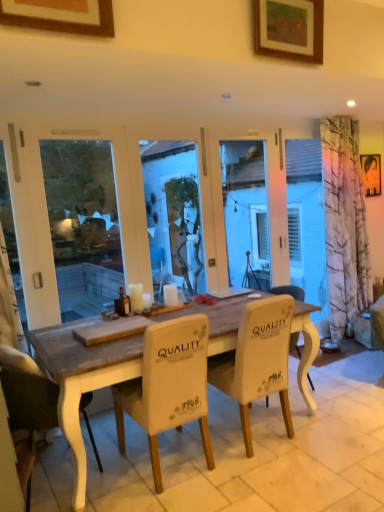
What do you see at coordinates (371, 174) in the screenshot?
I see `metallic silver portrait at upper right, the 3th picture frame viewed from the left` at bounding box center [371, 174].

Image resolution: width=384 pixels, height=512 pixels. What do you see at coordinates (170, 295) in the screenshot?
I see `white matte candle at center, which is the second candle in left-to-right order` at bounding box center [170, 295].

Locate an element on the screen. Image resolution: width=384 pixels, height=512 pixels. white fabric chair at center, the 2th chair when ordered from right to left is located at coordinates (168, 386).

The image size is (384, 512). What are the coordinates of `wooden picture frame at upper center, which is counted as the third picture frame, starting from the right` in the screenshot? It's located at (60, 15).

The image size is (384, 512). Describe the element at coordinates (136, 297) in the screenshot. I see `white wax candle at center, the second candle viewed from the right` at that location.

Where is `matte glass bottle at center`? This screenshot has height=512, width=384. matte glass bottle at center is located at coordinates (124, 300).

Measure the distance between matte glass bottle at center and camera.

They are 9.90 feet apart.

Identify the location of metallic silver portrait at upper right, the 3th picture frame viewed from the left. This screenshot has width=384, height=512. (371, 174).

Is white fabric chair at center, the third chair viewed from the left, not near white fabric chair at lower left, which ranks as the first chair in left-to-right order?

Yes.

How different are the orientations of white fabric chair at center, which is the first chair in right-to-left order, and white fabric chair at lower left, which ranks as the first chair in left-to-right order, in degrees?

The facing directions of white fabric chair at center, which is the first chair in right-to-left order, and white fabric chair at lower left, which ranks as the first chair in left-to-right order, are 90 degrees apart.

Is white fabric chair at lower left, the third chair in the right-to-left sequence, surrounded by white fabric chair at center, the third chair viewed from the left?

No, white fabric chair at lower left, the third chair in the right-to-left sequence, is not a part of white fabric chair at center, the third chair viewed from the left.

From the image's perspective, which one is positioned lower, white fabric chair at center, which is the first chair in right-to-left order, or white fabric chair at lower left, which ranks as the first chair in left-to-right order?

white fabric chair at lower left, which ranks as the first chair in left-to-right order, appears lower in the image.

Can you confirm if white fabric chair at center, the 2th chair when ordered from right to left, is thinner than wooden picture frame at upper center, arranged as the 2th picture frame when viewed from the front?

No.

Is white fabric chair at center, the 2th chair when ordered from right to left, taller than wooden picture frame at upper center, arranged as the 2th picture frame when viewed from the front?

Indeed, white fabric chair at center, the 2th chair when ordered from right to left, has a greater height compared to wooden picture frame at upper center, arranged as the 2th picture frame when viewed from the front.

What's the angular difference between white fabric chair at center, the 2th chair when ordered from right to left, and wooden picture frame at upper center, the 2th picture frame viewed from the left,'s facing directions?

white fabric chair at center, the 2th chair when ordered from right to left, and wooden picture frame at upper center, the 2th picture frame viewed from the left, are facing 180 degrees away from each other.

From the image's perspective, is white fabric chair at center, the 2th chair when ordered from right to left, located beneath wooden picture frame at upper center, arranged as the 2th picture frame when viewed from the front?

Correct, white fabric chair at center, the 2th chair when ordered from right to left, appears lower than wooden picture frame at upper center, arranged as the 2th picture frame when viewed from the front, in the image.

Is the position of wooden picture frame at upper center, arranged as the 2th picture frame when viewed from the front, more distant than that of white matte candle at center, which is the second candle in left-to-right order?

No, it is not.

Considering the sizes of objects wooden picture frame at upper center, arranged as the 2th picture frame when viewed from the front, and white matte candle at center, which is the second candle in left-to-right order, in the image provided, who is bigger, wooden picture frame at upper center, arranged as the 2th picture frame when viewed from the front, or white matte candle at center, which is the second candle in left-to-right order,?

With larger size is wooden picture frame at upper center, arranged as the 2th picture frame when viewed from the front.

Who is taller, wooden picture frame at upper center, the 2th picture frame viewed from the left, or white matte candle at center, which is the first candle in right-to-left order?

wooden picture frame at upper center, the 2th picture frame viewed from the left, is taller.

Considering the positions of objects white matte candle at center, which is the first candle in right-to-left order, and wooden picture frame at upper center, the first picture frame viewed from the left, in the image provided, who is in front, white matte candle at center, which is the first candle in right-to-left order, or wooden picture frame at upper center, the first picture frame viewed from the left,?

wooden picture frame at upper center, the first picture frame viewed from the left, is more forward.

From a real-world perspective, does white matte candle at center, which is the second candle in left-to-right order, stand above wooden picture frame at upper center, which ranks as the first picture frame in front-to-back order?

→ No, from a real-world perspective, white matte candle at center, which is the second candle in left-to-right order, is not over wooden picture frame at upper center, which ranks as the first picture frame in front-to-back order

Which object is positioned more to the left, white matte candle at center, which is the second candle in left-to-right order, or wooden picture frame at upper center, which is the 3th picture frame in back-to-front order?

From the viewer's perspective, wooden picture frame at upper center, which is the 3th picture frame in back-to-front order, appears more on the left side.

What's the angular difference between white matte candle at center, which is the second candle in left-to-right order, and wooden picture frame at upper center, which is counted as the third picture frame, starting from the right,'s facing directions?

The angle between the facing direction of white matte candle at center, which is the second candle in left-to-right order, and the facing direction of wooden picture frame at upper center, which is counted as the third picture frame, starting from the right, is 0.00308 degrees.

Where is `chair that is the 1st object located below the wooden picture frame at upper center, which is the 3th picture frame in back-to-front order (from the image's perspective)`? The height and width of the screenshot is (512, 384). chair that is the 1st object located below the wooden picture frame at upper center, which is the 3th picture frame in back-to-front order (from the image's perspective) is located at coordinates (257, 360).

How far apart are white fabric chair at center, which is the first chair in right-to-left order, and wooden picture frame at upper center, which ranks as the first picture frame in front-to-back order?

A distance of 6.13 feet exists between white fabric chair at center, which is the first chair in right-to-left order, and wooden picture frame at upper center, which ranks as the first picture frame in front-to-back order.

Does white fabric chair at center, which is the first chair in right-to-left order, lie in front of wooden picture frame at upper center, the first picture frame viewed from the left?

That is False.

Is white fabric chair at center, the third chair viewed from the left, bigger or smaller than wooden picture frame at upper center, which is the 3th picture frame in back-to-front order?

Considering their sizes, white fabric chair at center, the third chair viewed from the left, takes up more space than wooden picture frame at upper center, which is the 3th picture frame in back-to-front order.

The image size is (384, 512). I want to click on the 1st chair below the matte glass bottle at center (from the image's perspective), so click(x=257, y=360).

How different are the orientations of white fabric chair at center, which is the first chair in right-to-left order, and matte glass bottle at center in degrees?

They differ by 180 degrees in their facing directions.

Are white fabric chair at center, the third chair viewed from the left, and matte glass bottle at center far apart?

No, white fabric chair at center, the third chair viewed from the left, is in close proximity to matte glass bottle at center.

Looking at this image, from a real-world perspective, is white fabric chair at lower left, which ranks as the first chair in left-to-right order, above or below metallic silver portrait at upper right, the 3th picture frame viewed from the left?

In terms of real-world spatial position, white fabric chair at lower left, which ranks as the first chair in left-to-right order, is below metallic silver portrait at upper right, the 3th picture frame viewed from the left.

How much distance is there between white fabric chair at lower left, which ranks as the first chair in left-to-right order, and metallic silver portrait at upper right, which appears as the 1th picture frame when viewed from the back?

The distance of white fabric chair at lower left, which ranks as the first chair in left-to-right order, from metallic silver portrait at upper right, which appears as the 1th picture frame when viewed from the back, is 3.68 meters.

Is point (49, 411) behind point (376, 189)?

No, it is in front of (376, 189).

Can you confirm if white fabric chair at lower left, the third chair in the right-to-left sequence, is smaller than metallic silver portrait at upper right, the 1th picture frame in the right-to-left sequence?

Actually, white fabric chair at lower left, the third chair in the right-to-left sequence, might be larger than metallic silver portrait at upper right, the 1th picture frame in the right-to-left sequence.

Image resolution: width=384 pixels, height=512 pixels. What are the coordinates of `chair behind the white fabric chair at lower left, the third chair in the right-to-left sequence` in the screenshot? It's located at (257, 360).

From the image's perspective, which picture frame is the 3rd one above the white fabric chair at center, which is counted as the second chair, starting from the left? Please provide its 2D coordinates.

[(289, 29)]

Which object lies further to the anchor point wooden picture frame at upper center, the 2th picture frame positioned from the right, white fabric chair at center, which is the first chair in right-to-left order, or white matte candle at center, which is the first candle in right-to-left order?

white matte candle at center, which is the first candle in right-to-left order, lies further to wooden picture frame at upper center, the 2th picture frame positioned from the right, than the other object.

Looking at the image, which one is located further to matte glass bottle at center, metallic silver portrait at upper right, the 3th picture frame viewed from the left, or white fabric chair at center, which is counted as the second chair, starting from the left?

metallic silver portrait at upper right, the 3th picture frame viewed from the left.

Considering their positions, is white matte candle at center, which is the second candle in left-to-right order, positioned further to white fabric chair at center, the 2th chair when ordered from right to left, than wooden picture frame at upper center, the first picture frame viewed from the left?

wooden picture frame at upper center, the first picture frame viewed from the left, is positioned further to the anchor white fabric chair at center, the 2th chair when ordered from right to left.

Which object lies further to the anchor point white matte candle at center, which is the first candle in right-to-left order, wooden picture frame at upper center, the first picture frame viewed from the left, or matte glass bottle at center?

wooden picture frame at upper center, the first picture frame viewed from the left.

Estimate the real-world distances between objects in this image. Which object is further from white wax candle at center, the second candle viewed from the right, white fabric chair at center, the third chair viewed from the left, or white wood desk at center?

white fabric chair at center, the third chair viewed from the left, lies further to white wax candle at center, the second candle viewed from the right, than the other object.

Based on their spatial positions, is white fabric chair at center, the 2th chair when ordered from right to left, or wooden picture frame at upper center, the 2th picture frame viewed from the left, closer to metallic silver portrait at upper right, the 1th picture frame in the right-to-left sequence?

wooden picture frame at upper center, the 2th picture frame viewed from the left, lies closer to metallic silver portrait at upper right, the 1th picture frame in the right-to-left sequence, than the other object.

When comparing their distances from white fabric chair at center, the 2th chair when ordered from right to left, does white fabric chair at lower left, the third chair in the right-to-left sequence, or white matte candle at center, which is the first candle in right-to-left order, seem further?

Among the two, white matte candle at center, which is the first candle in right-to-left order, is located further to white fabric chair at center, the 2th chair when ordered from right to left.

Considering their positions, is white wood desk at center positioned further to matte glass bottle at center than white matte candle at center, which is the second candle in left-to-right order?

white wood desk at center is further to matte glass bottle at center.

This screenshot has height=512, width=384. Find the location of `chair positioned between wooden picture frame at upper center, the 2th picture frame viewed from the left, and metallic silver portrait at upper right, placed as the third picture frame when sorted from front to back, from near to far`. chair positioned between wooden picture frame at upper center, the 2th picture frame viewed from the left, and metallic silver portrait at upper right, placed as the third picture frame when sorted from front to back, from near to far is located at coordinates (257, 360).

In order to click on candle between white wood desk at center and white matte candle at center, which is the second candle in left-to-right order, along the z-axis in this screenshot , I will do `click(136, 297)`.

Identify the location of chair between wooden picture frame at upper center, which is the 3th picture frame in back-to-front order, and white fabric chair at center, which is counted as the second chair, starting from the left, in the up-down direction. The height and width of the screenshot is (512, 384). (257, 360).

Find the location of a particular element. picture frame between white fabric chair at center, which is counted as the second chair, starting from the left, and metallic silver portrait at upper right, the 1th picture frame in the right-to-left sequence, from front to back is located at coordinates (289, 29).